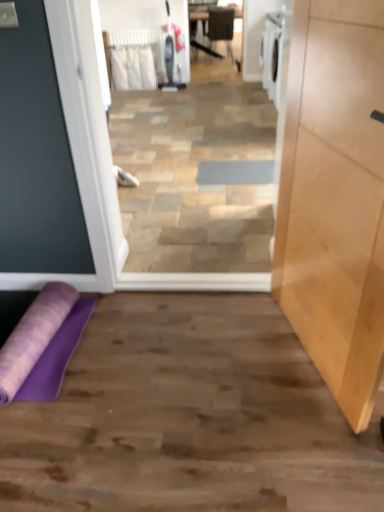
This screenshot has height=512, width=384. Find the location of `free space above gray fabric doormat at center (from a real-world perspective)`. free space above gray fabric doormat at center (from a real-world perspective) is located at coordinates pyautogui.click(x=233, y=168).